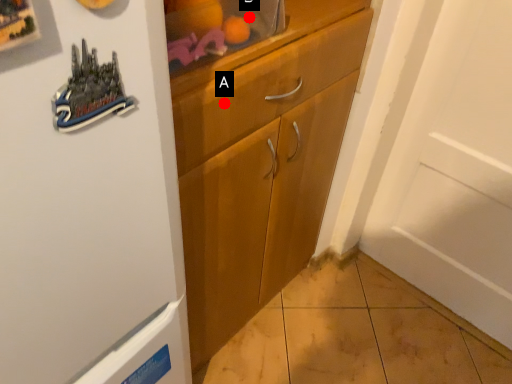
Question: Two points are circled on the image, labeled by A and B beside each circle. Among these points, which one is nearest to the camera?

Choices:
 (A) A is closer
 (B) B is closer

Answer: (A)